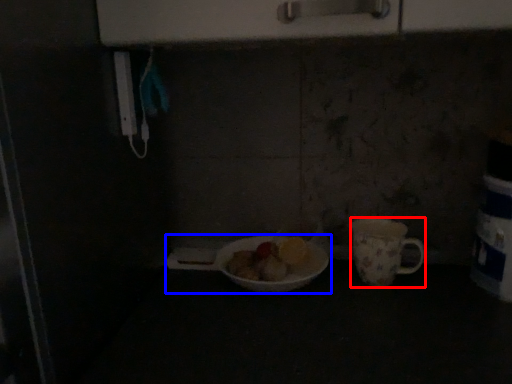
Question: Which point is further to the camera, coffee cup (highlighted by a red box) or tableware (highlighted by a blue box)?

Choices:
 (A) coffee cup
 (B) tableware

Answer: (A)